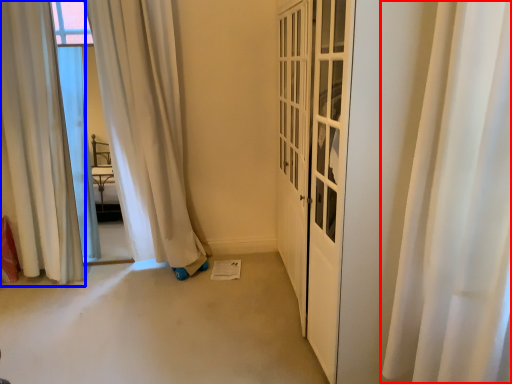
Question: Which object appears closest to the camera in this image, curtain (highlighted by a red box) or curtain (highlighted by a blue box)?

Choices:
 (A) curtain
 (B) curtain

Answer: (A)